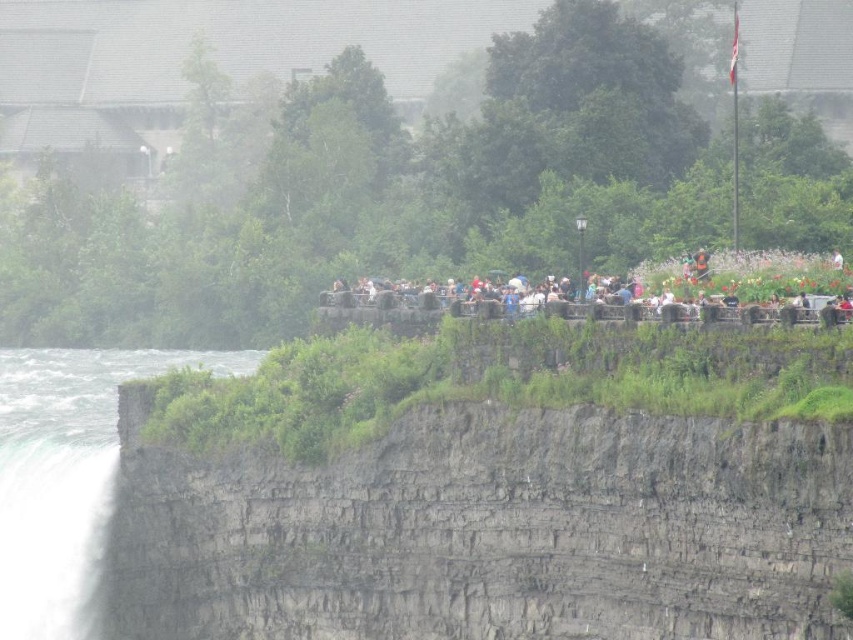
Question: Which point appears closest to the camera in this image?

Choices:
 (A) (10, 356)
 (B) (44, 627)
 (C) (611, 301)

Answer: (C)

Question: Does white frothy water at lower left have a smaller size compared to matte black people at center?

Choices:
 (A) yes
 (B) no

Answer: (B)

Question: Is white frothy water at lower left positioned at the back of white misty waterfall at lower left?

Choices:
 (A) no
 (B) yes

Answer: (B)

Question: Which of the following is the closest to the observer?

Choices:
 (A) click(x=68, y=420)
 (B) click(x=630, y=317)

Answer: (B)

Question: Estimate the real-world distances between objects in this image. Which object is closer to the matte black people at center?

Choices:
 (A) white frothy water at lower left
 (B) white misty waterfall at lower left

Answer: (B)

Question: Does white misty waterfall at lower left have a lesser width compared to matte black people at center?

Choices:
 (A) yes
 (B) no

Answer: (A)